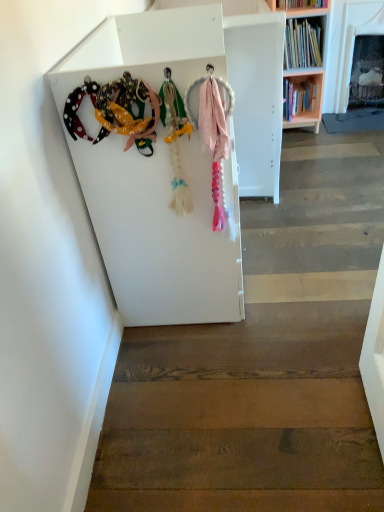
Locate an element on the screen. Image resolution: width=384 pixels, height=512 pixels. free space above wooden floor at center (from a real-world perspective) is located at coordinates (311, 242).